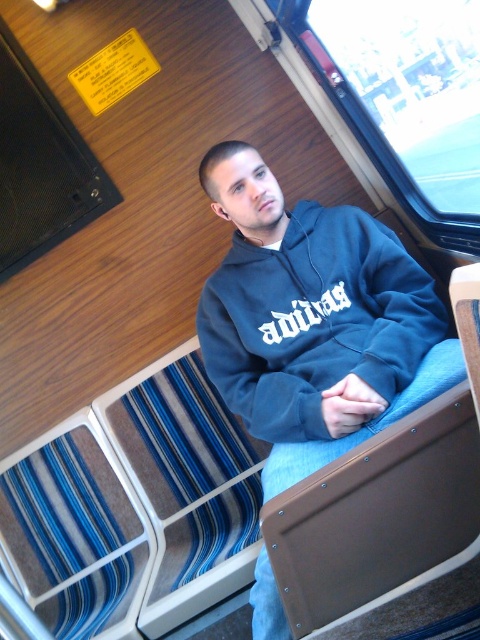
You are a passenger in the train car and want to put your dark blue hoodie at center and dark blue fleece sweatshirt at center into a small backpack. Which item should you place first to ensure both fit properly?

The dark blue hoodie at center is closer to the viewer than dark blue fleece sweatshirt at center, so you should place the dark blue fleece sweatshirt at center first to make space for the hoodie.

You are a clothing designer who wants to create a new line of outerwear. You observe the dark blue hoodie at center and the dark blue fleece sweatshirt at center in the image. Which one has a wider design?

The dark blue hoodie at center has a wider design than the dark blue fleece sweatshirt at center.